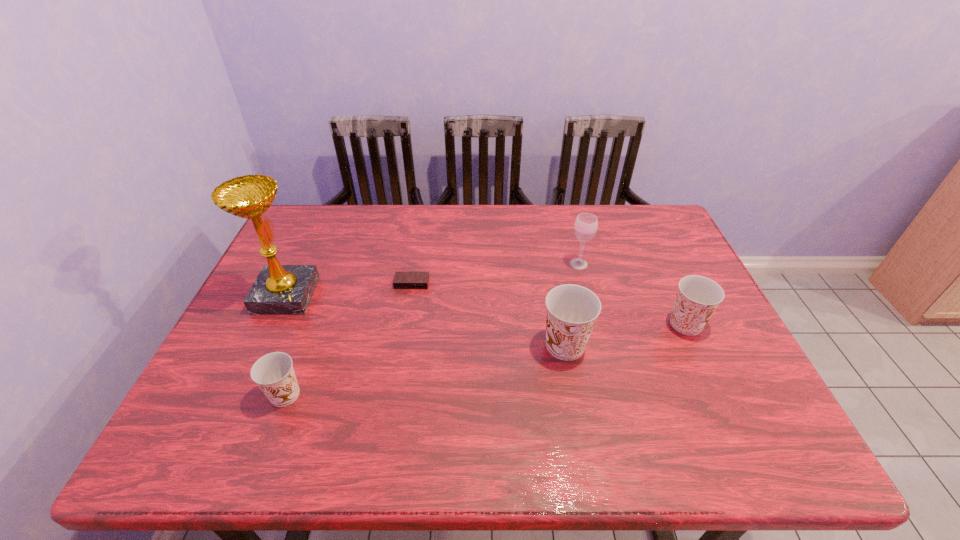
Find the location of a particular element. free space that satisfies the following two spatial constraints: 1. on the front face of the shortest object; 2. on the front-facing side of the award is located at coordinates (410, 295).

You are a GUI agent. You are given a task and a screenshot of the screen. Output one action in this format:
    pyautogui.click(x=<x>, y=<y>)
    Task: Click on the vacant space that satisfies the following two spatial constraints: 1. on the front side of the farthest object; 2. on the right side of the fourth tallest object
    The image size is (960, 540).
    Given the screenshot: What is the action you would take?
    pyautogui.click(x=594, y=324)

Identify the location of vacant space that satisfies the following two spatial constraints: 1. on the front face of the fourth object from right to left; 2. on the right side of the fourth tallest object. (405, 324).

You are a GUI agent. You are given a task and a screenshot of the screen. Output one action in this format:
    pyautogui.click(x=<x>, y=<y>)
    Task: Click on the free space in the image that satisfies the following two spatial constraints: 1. on the front-facing side of the award; 2. on the right side of the rightmost object
    This screenshot has height=540, width=960.
    Given the screenshot: What is the action you would take?
    pyautogui.click(x=273, y=324)

At what (x,y) coordinates should I click in order to perform the action: click on free space that satisfies the following two spatial constraints: 1. on the front-facing side of the award; 2. on the back side of the third shortest object. Please return your answer as a coordinate pair (x, y). Image resolution: width=960 pixels, height=540 pixels. Looking at the image, I should click on (273, 324).